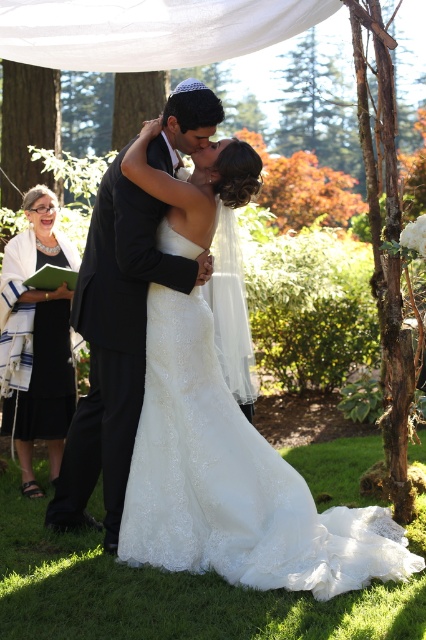
Does white lace dress at center come behind black satin suit at center?

No, white lace dress at center is closer to the viewer.

Who is higher up, white lace dress at center or black satin suit at center?

black satin suit at center is higher up.

Identify the location of white lace dress at center. The image size is (426, 640). (233, 481).

Can you confirm if white lace dress at center is positioned to the left of black dress at left?

Incorrect, white lace dress at center is not on the left side of black dress at left.

Can you confirm if white lace dress at center is positioned above black dress at left?

Incorrect, white lace dress at center is not positioned above black dress at left.

What do you see at coordinates (233, 481) in the screenshot?
I see `white lace dress at center` at bounding box center [233, 481].

In order to click on white lace dress at center in this screenshot , I will do `click(233, 481)`.

Based on the photo, which of these two, black satin suit at center or black dress at left, stands shorter?

Standing shorter between the two is black dress at left.

Between point (146, 288) and point (3, 317), which one is positioned in front?

Positioned in front is point (146, 288).

Image resolution: width=426 pixels, height=640 pixels. Describe the element at coordinates (114, 346) in the screenshot. I see `black satin suit at center` at that location.

Find the location of a particular element. The image size is (426, 640). black satin suit at center is located at coordinates (114, 346).